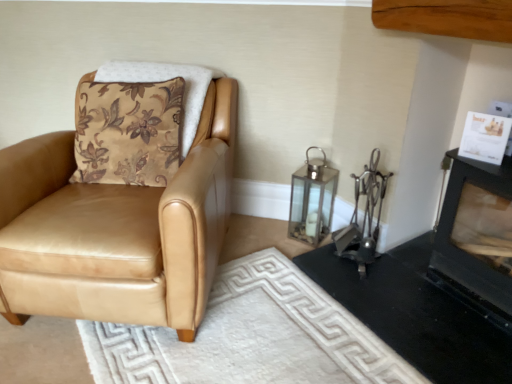
Question: Is black matte fireplace at lower right, which is the 1th fireplace from bottom to top, positioned before white textured rug at lower center?

Choices:
 (A) no
 (B) yes

Answer: (A)

Question: Is white textured rug at lower center completely or partially inside black matte fireplace at lower right, which is the 1th fireplace from bottom to top?

Choices:
 (A) yes
 (B) no

Answer: (B)

Question: Can you confirm if black matte fireplace at lower right, which is the 1th fireplace from bottom to top, is wider than white textured rug at lower center?

Choices:
 (A) yes
 (B) no

Answer: (B)

Question: From the image's perspective, is black matte fireplace at lower right, which is the 1th fireplace from bottom to top, on white textured rug at lower center?

Choices:
 (A) yes
 (B) no

Answer: (A)

Question: From a real-world perspective, is black matte fireplace at lower right, which is the 1th fireplace from bottom to top, below white textured rug at lower center?

Choices:
 (A) no
 (B) yes

Answer: (A)

Question: Does black matte fireplace at lower right, which is the 1th fireplace from bottom to top, have a lesser height compared to white textured rug at lower center?

Choices:
 (A) yes
 (B) no

Answer: (A)

Question: Is tan leather chair at left further to the viewer compared to black matte fireplace at upper right, placed as the second fireplace when sorted from bottom to top?

Choices:
 (A) yes
 (B) no

Answer: (A)

Question: Does tan leather chair at left have a lesser height compared to black matte fireplace at upper right, acting as the 1th fireplace starting from the top?

Choices:
 (A) no
 (B) yes

Answer: (B)

Question: Does tan leather chair at left come in front of black matte fireplace at upper right, placed as the second fireplace when sorted from bottom to top?

Choices:
 (A) no
 (B) yes

Answer: (A)

Question: Is tan leather chair at left oriented away from black matte fireplace at upper right, acting as the 1th fireplace starting from the top?

Choices:
 (A) no
 (B) yes

Answer: (A)

Question: Would you say tan leather chair at left is outside black matte fireplace at upper right, placed as the second fireplace when sorted from bottom to top?

Choices:
 (A) yes
 (B) no

Answer: (A)

Question: From the image's perspective, does tan leather chair at left appear lower than black matte fireplace at upper right, placed as the second fireplace when sorted from bottom to top?

Choices:
 (A) no
 (B) yes

Answer: (A)

Question: From the image's perspective, does tan leather chair at left appear lower than white textured rug at lower center?

Choices:
 (A) no
 (B) yes

Answer: (A)